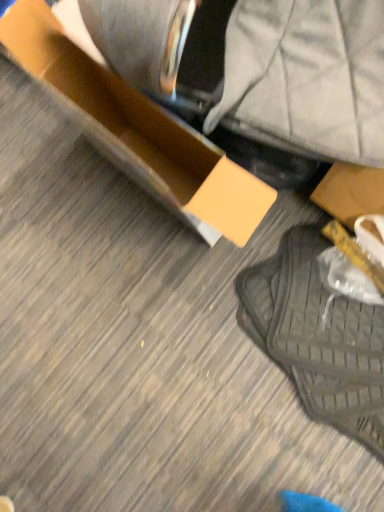
Describe the element at coordinates (137, 131) in the screenshot. I see `matte cardboard box at center` at that location.

You are a GUI agent. You are given a task and a screenshot of the screen. Output one action in this format:
    pyautogui.click(x=<x>, y=<y>)
    Task: Click on the matte cardboard box at center
    The height and width of the screenshot is (512, 384).
    Given the screenshot: What is the action you would take?
    pyautogui.click(x=137, y=131)

Image resolution: width=384 pixels, height=512 pixels. What are the coordinates of `black mesh bag at lower right` in the screenshot? It's located at (317, 337).

Measure the distance between black mesh bag at lower right and camera.

black mesh bag at lower right and camera are 3.37 feet apart.

This screenshot has height=512, width=384. What do you see at coordinates (317, 337) in the screenshot?
I see `black mesh bag at lower right` at bounding box center [317, 337].

The width and height of the screenshot is (384, 512). Find the location of `matte cardboard box at center`. matte cardboard box at center is located at coordinates (137, 131).

Can you confirm if matte cardboard box at center is positioned to the left of black mesh bag at lower right?

Yes.

Considering the positions of objects matte cardboard box at center and black mesh bag at lower right in the image provided, who is in front, matte cardboard box at center or black mesh bag at lower right?

matte cardboard box at center is in front.

Is point (64, 109) closer to camera compared to point (347, 342)?

No.

From the image's perspective, which one is positioned higher, matte cardboard box at center or black mesh bag at lower right?

matte cardboard box at center, from the image's perspective.

From a real-world perspective, relative to black mesh bag at lower right, is matte cardboard box at center vertically above or below?

matte cardboard box at center is above black mesh bag at lower right.

In the scene shown: Can you confirm if matte cardboard box at center is wider than black mesh bag at lower right?

Incorrect, the width of matte cardboard box at center does not surpass that of black mesh bag at lower right.

Who is shorter, matte cardboard box at center or black mesh bag at lower right?

With less height is black mesh bag at lower right.

From the picture: In terms of size, does matte cardboard box at center appear bigger or smaller than black mesh bag at lower right?

Clearly, matte cardboard box at center is larger in size than black mesh bag at lower right.

Which is correct: matte cardboard box at center is inside black mesh bag at lower right, or outside of it?

The correct answer is: outside.

Are matte cardboard box at center and black mesh bag at lower right making contact?

matte cardboard box at center and black mesh bag at lower right are clearly separated.

Is matte cardboard box at center looking in the opposite direction of black mesh bag at lower right?

No, matte cardboard box at center is not facing away from black mesh bag at lower right.

What's the angular difference between matte cardboard box at center and black mesh bag at lower right's facing directions?

The facing directions of matte cardboard box at center and black mesh bag at lower right are 3.03 degrees apart.

Find the location of a particular element. This screenshot has width=384, height=512. footwear below the matte cardboard box at center (from the image's perspective) is located at coordinates (317, 337).

Which is more to the left, black mesh bag at lower right or matte cardboard box at center?

From the viewer's perspective, matte cardboard box at center appears more on the left side.

Is black mesh bag at lower right further to camera compared to matte cardboard box at center?

Yes, black mesh bag at lower right is further from the viewer.

Is point (277, 329) positioned before point (214, 158)?

No.

From the image's perspective, is black mesh bag at lower right on top of matte cardboard box at center?

No, from the image's perspective, black mesh bag at lower right is not above matte cardboard box at center.

From a real-world perspective, is black mesh bag at lower right positioned above or below matte cardboard box at center?

In terms of real-world spatial position, black mesh bag at lower right is below matte cardboard box at center.

Which object is thinner, black mesh bag at lower right or matte cardboard box at center?

matte cardboard box at center.

Who is taller, black mesh bag at lower right or matte cardboard box at center?

matte cardboard box at center is taller.

Can you confirm if black mesh bag at lower right is smaller than matte cardboard box at center?

Indeed, black mesh bag at lower right has a smaller size compared to matte cardboard box at center.

Do you think black mesh bag at lower right is within matte cardboard box at center, or outside of it?

The correct answer is: outside.

Is black mesh bag at lower right next to matte cardboard box at center?

No.

Could you tell me if black mesh bag at lower right is turned towards matte cardboard box at center?

No.

Locate an element on the screen. Image resolution: width=384 pixels, height=512 pixels. footwear beneath the matte cardboard box at center (from a real-world perspective) is located at coordinates (317, 337).

Locate an element on the screen. The height and width of the screenshot is (512, 384). footwear that appears on the right of matte cardboard box at center is located at coordinates (317, 337).

You are a GUI agent. You are given a task and a screenshot of the screen. Output one action in this format:
    pyautogui.click(x=<x>, y=<y>)
    Task: Click on the footwear located underneath the matte cardboard box at center (from a real-world perspective)
    
    Given the screenshot: What is the action you would take?
    pyautogui.click(x=317, y=337)